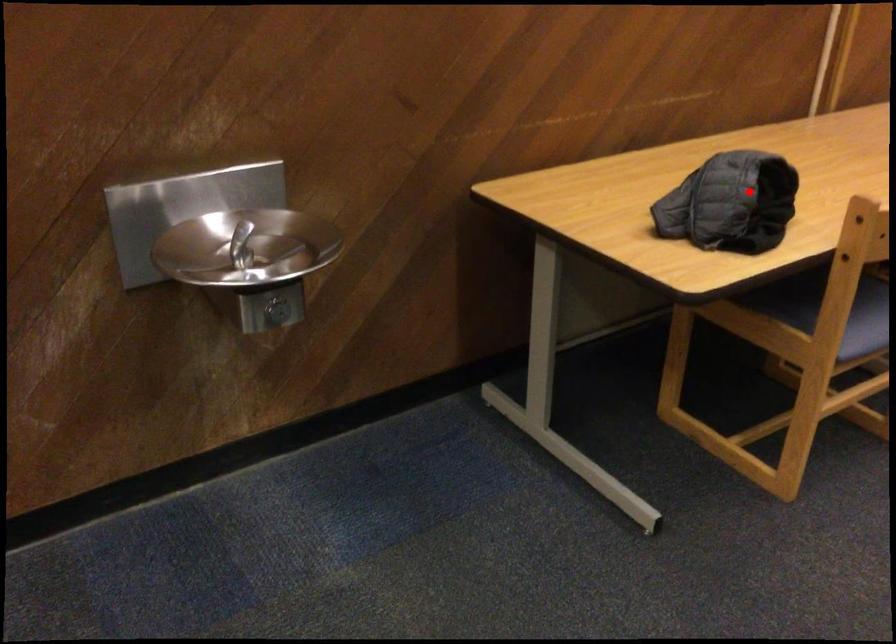
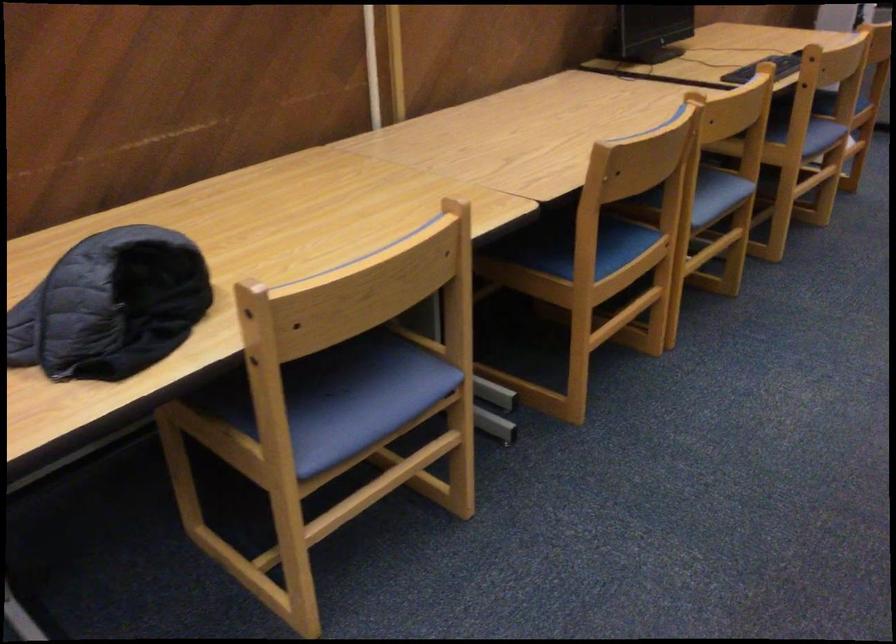
Question: I am providing you with two images of the same scene from different viewpoints. Image1 has a red point marked. In image2, the corresponding 3D location appears at what relative position? Reply with the corresponding letter.

Choices:
 (A) Closer
 (B) Farther

Answer: (A)